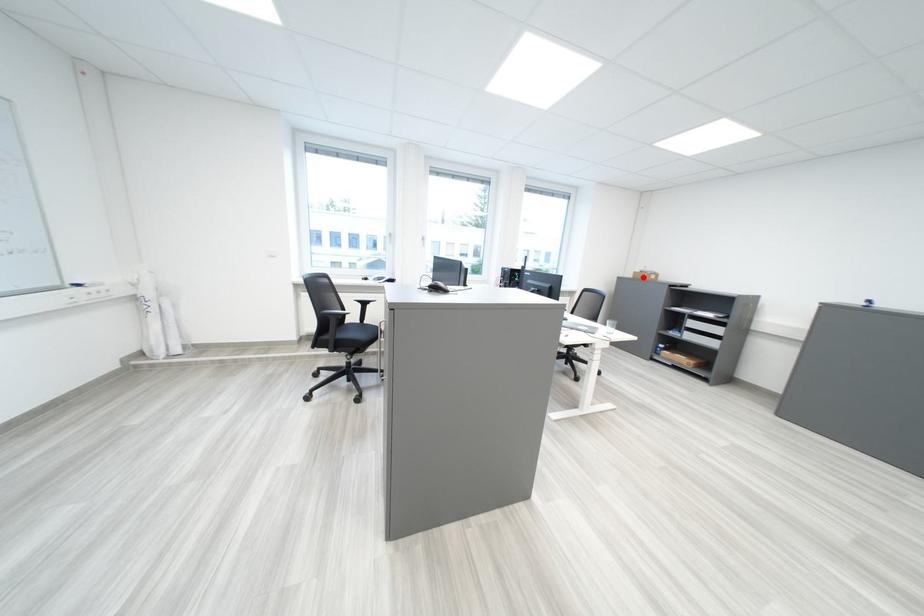
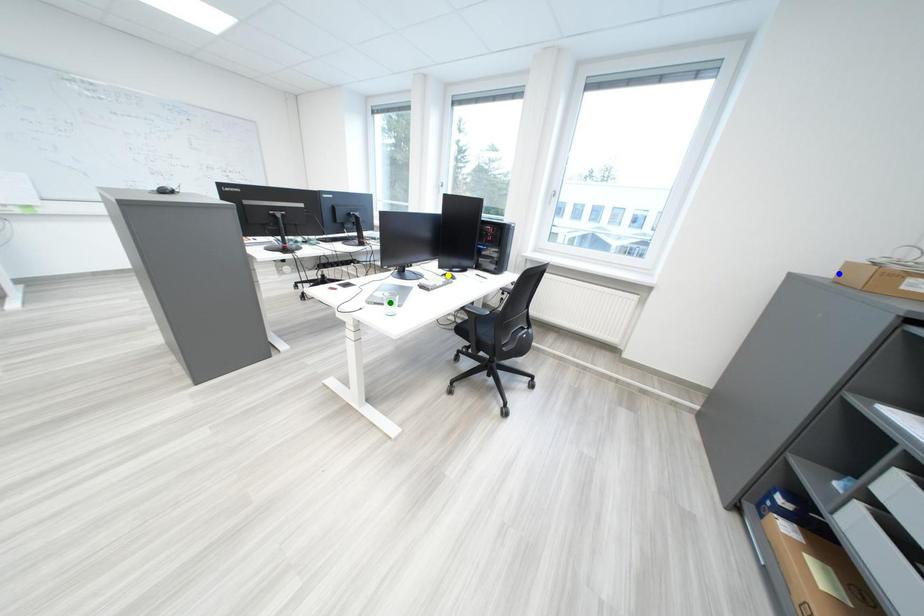
Question: I am providing you with two images of the same scene from different viewpoints. A red point is marked on the first image. You are given multiple points on the second image. Can you choose the point in image 2 that corresponds to the point in image 1?

Choices:
 (A) yellow point
 (B) blue point
 (C) green point

Answer: (B)